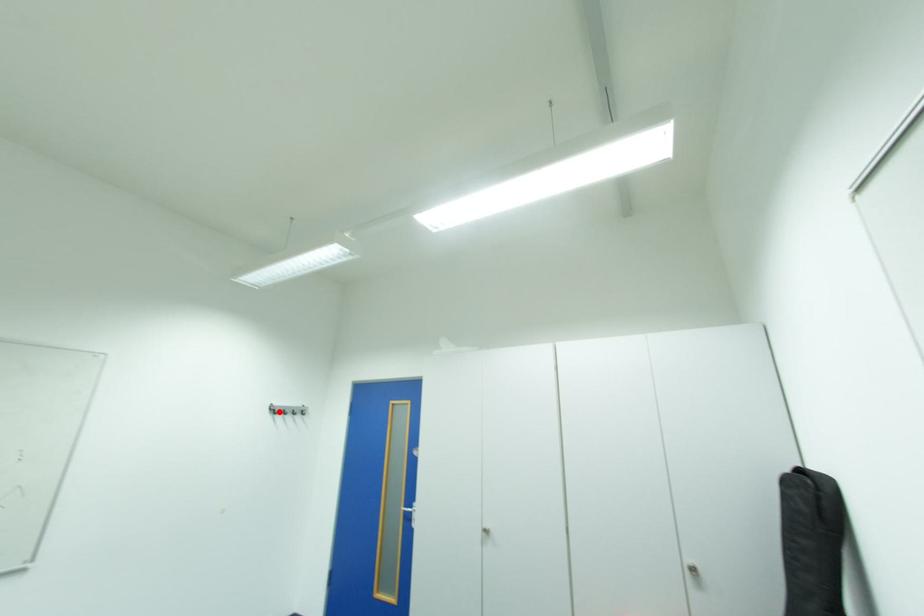
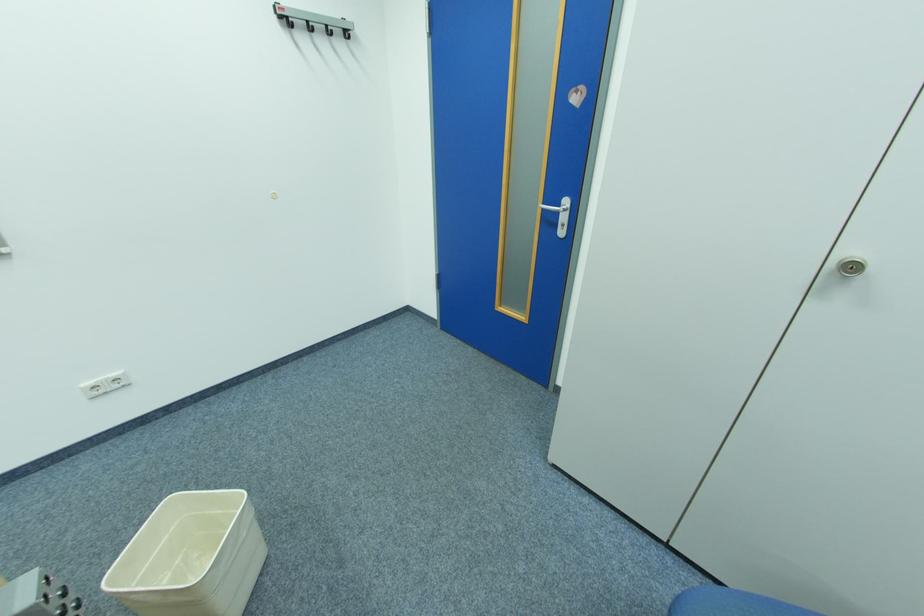
Question: I am providing you with two images of the same scene from different viewpoints. A red point is marked on the first image. Can you still see the location of the red point in image 2?

Choices:
 (A) Yes
 (B) No

Answer: (A)